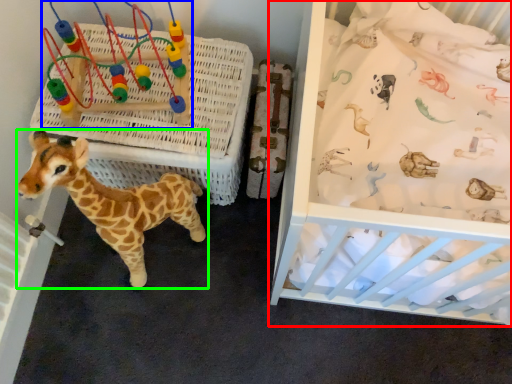
Question: Which object is positioned farthest from infant bed (highlighted by a red box)? Select from toy (highlighted by a blue box) and giraffe (highlighted by a green box).

Choices:
 (A) toy
 (B) giraffe

Answer: (A)